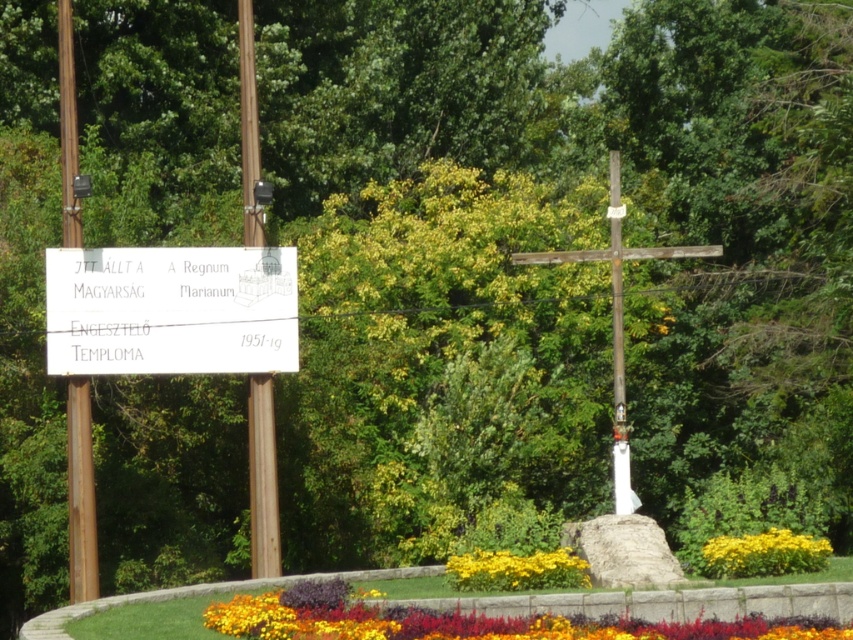
Question: Is brown wooden signpost at left thinner than smooth wooden post at center?

Choices:
 (A) yes
 (B) no

Answer: (B)

Question: Does brown wooden signpost at left have a greater width compared to yellow matte flower at lower center?

Choices:
 (A) no
 (B) yes

Answer: (B)

Question: Is brown wooden signpost at left smaller than wooden cross at center?

Choices:
 (A) yes
 (B) no

Answer: (A)

Question: Considering the real-world distances, which object is farthest from the multicolored fabric flowers at lower center?

Choices:
 (A) wooden cross at center
 (B) yellow matte flower at lower right
 (C) yellow matte flower at lower center
 (D) white paper sign at upper left

Answer: (D)

Question: Which object appears closest to the camera in this image?

Choices:
 (A) multicolored fabric flowers at lower center
 (B) brown wooden signpost at left

Answer: (A)

Question: Considering the real-world distances, which object is farthest from the multicolored fabric flowers at lower center?

Choices:
 (A) smooth wooden post at center
 (B) yellow matte flower at lower right
 (C) yellow matte flower at lower center

Answer: (A)